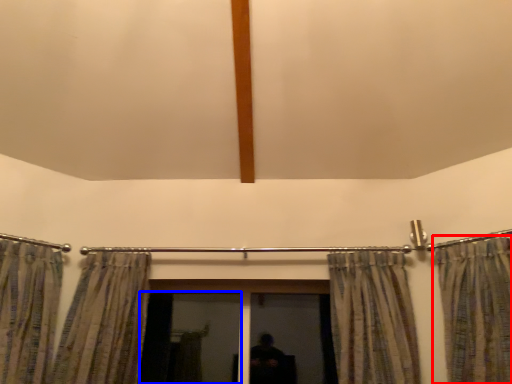
Question: Which object appears closest to the camera in this image, curtain (highlighted by a red box) or screen door (highlighted by a blue box)?

Choices:
 (A) curtain
 (B) screen door

Answer: (A)